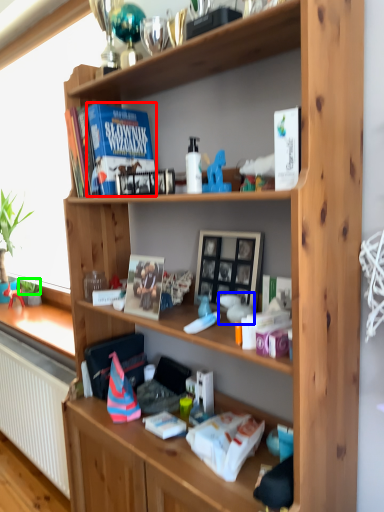
Question: Which object is the closest to the paperback book (highlighted by a red box)? Choose among these: toy (highlighted by a blue box) or plant (highlighted by a green box).

Choices:
 (A) toy
 (B) plant

Answer: (A)